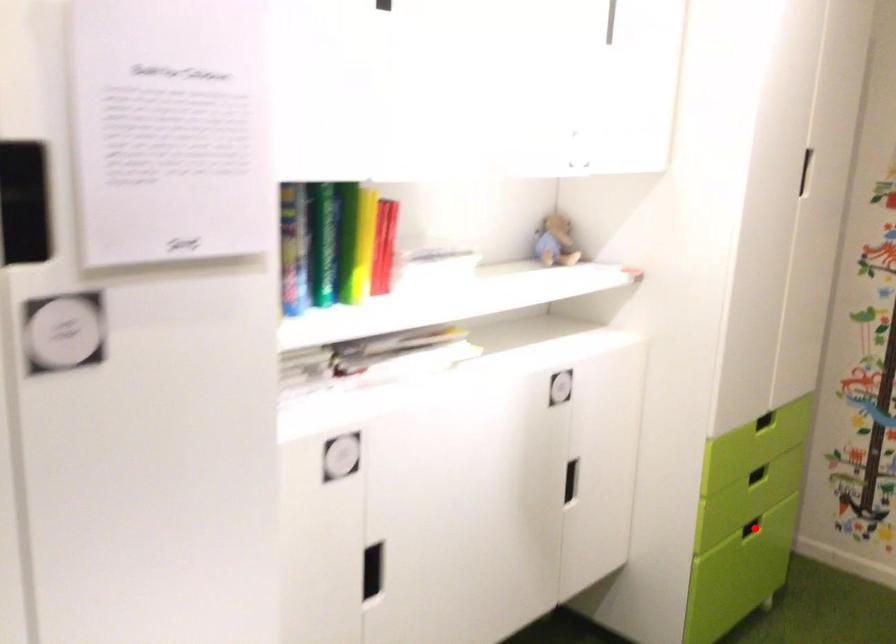
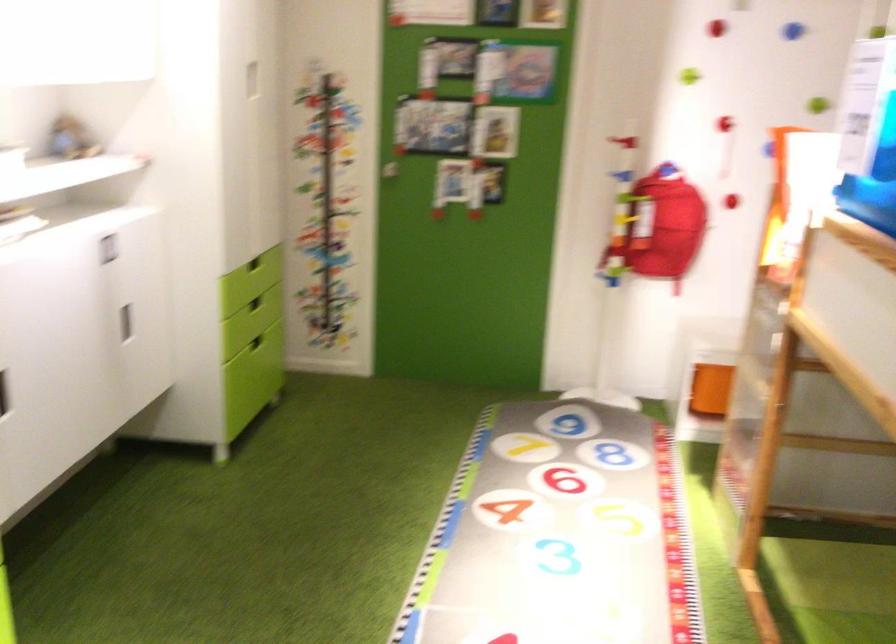
Question: I am providing you with two images of the same scene from different viewpoints. In image1, a red point is highlighted. Considering the same 3D point in image2, which of the following is correct?

Choices:
 (A) It is closer
 (B) It is farther

Answer: (B)